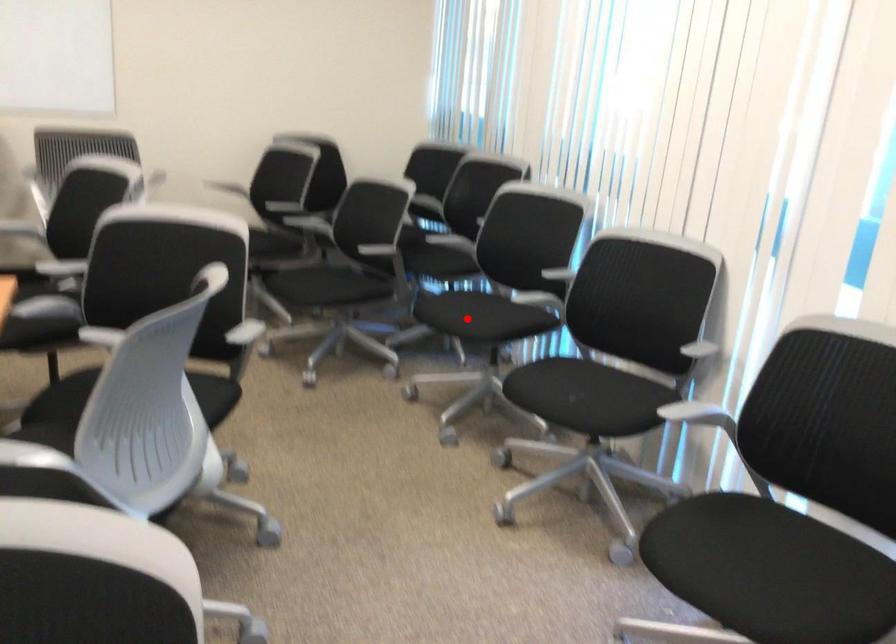
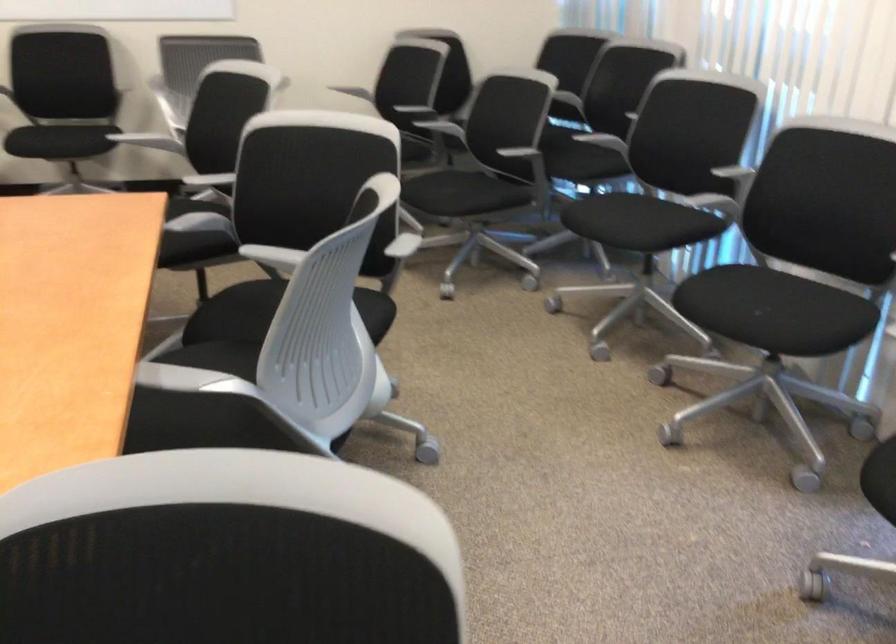
The point at the highlighted location is marked in the first image. Where is the corresponding point in the second image?

(624, 221)